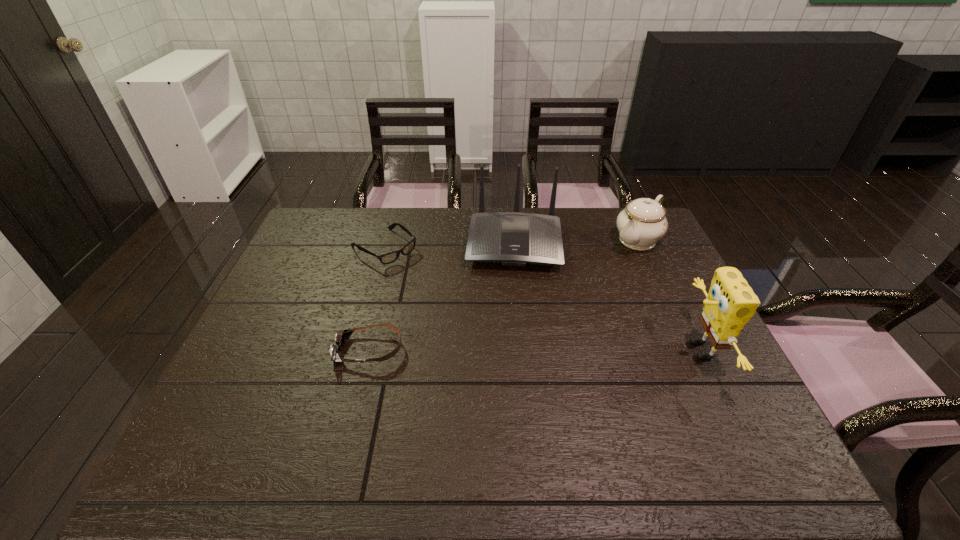
Where is `router at the far edge`? router at the far edge is located at coordinates (512, 238).

I want to click on chinaware at the far edge, so click(x=643, y=222).

Identify the location of spectacles that is at the far edge. The width and height of the screenshot is (960, 540). (388, 258).

At what (x,y) coordinates should I click in order to perform the action: click on object present at the near edge. Please return your answer as a coordinate pair (x, y). Looking at the image, I should click on (731, 302).

The image size is (960, 540). I want to click on sponge located at the right edge, so click(731, 302).

I want to click on chinaware that is at the right edge, so click(x=643, y=222).

Identify the location of object that is positioned at the far right corner. The height and width of the screenshot is (540, 960). (643, 222).

Where is `object that is at the near right corner`? Image resolution: width=960 pixels, height=540 pixels. object that is at the near right corner is located at coordinates (731, 302).

Identify the location of vacant space at the far edge of the desktop. (582, 233).

Image resolution: width=960 pixels, height=540 pixels. In order to click on vacant space at the near edge in this screenshot , I will do `click(518, 406)`.